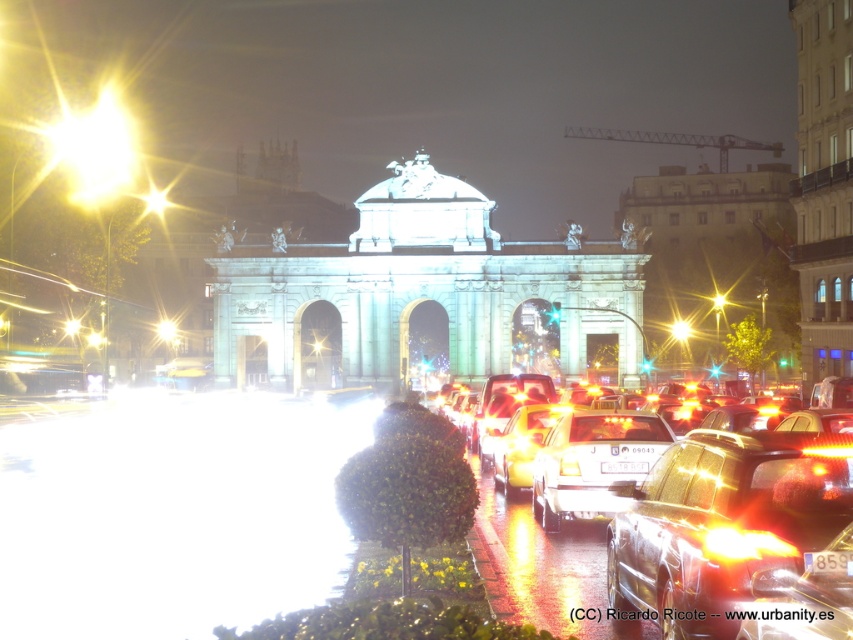
Between point (605, 540) and point (808, 624), which one is positioned in front?

Positioned in front is point (808, 624).

This screenshot has width=853, height=640. What are the coordinates of `metallic silver sedan at center` in the screenshot? It's located at (726, 522).

Find the location of a particular element. This screenshot has width=853, height=640. metallic silver sedan at center is located at coordinates (726, 522).

Between metallic silver sedan at center and shiny metallic car at center, which one has more height?

With more height is metallic silver sedan at center.

Identify the location of metallic silver sedan at center. The image size is (853, 640). (726, 522).

Find the location of a particular element. metallic silver sedan at center is located at coordinates (726, 522).

Can you confirm if shiny metallic car at center is positioned to the left of shiny orange car at center?

Yes, shiny metallic car at center is to the left of shiny orange car at center.

Who is more forward, (547, 486) or (753, 604)?

Point (753, 604) is in front.

Which is in front, point (589, 476) or point (846, 579)?

Positioned in front is point (846, 579).

Locate an element on the screen. shiny metallic car at center is located at coordinates (593, 464).